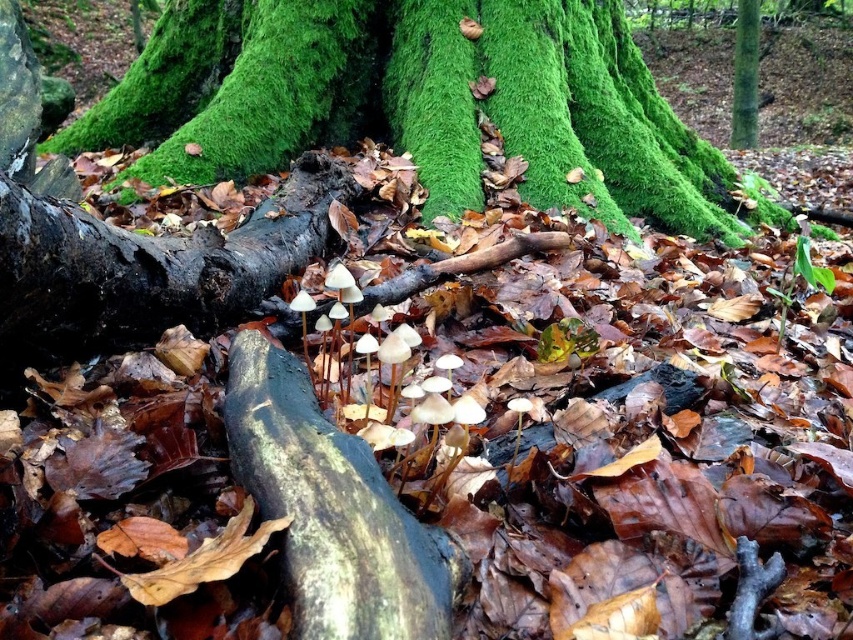
Question: Is green mossy tree trunk at center thinner than green smooth tree trunk at upper right?

Choices:
 (A) no
 (B) yes

Answer: (A)

Question: Is green mossy tree trunk at center below green smooth tree trunk at upper right?

Choices:
 (A) no
 (B) yes

Answer: (B)

Question: Among these points, which one is farthest from the camera?

Choices:
 (A) (741, 93)
 (B) (421, 179)

Answer: (A)

Question: Is green mossy tree trunk at center in front of green smooth tree trunk at upper right?

Choices:
 (A) no
 (B) yes

Answer: (B)

Question: Which point is closer to the camera?

Choices:
 (A) green mossy tree trunk at center
 (B) green smooth tree trunk at upper right

Answer: (A)